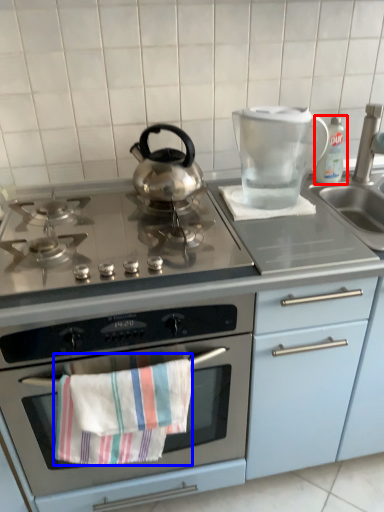
Question: Among these objects, which one is farthest to the camera, bottle (highlighted by a red box) or beach towel (highlighted by a blue box)?

Choices:
 (A) bottle
 (B) beach towel

Answer: (A)